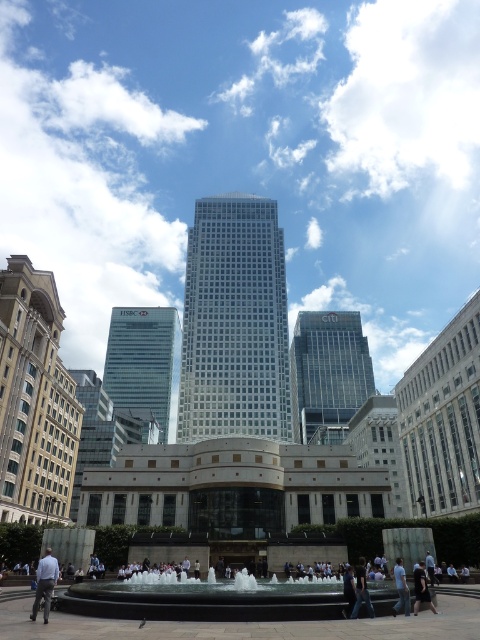
Question: Does white glass skyscraper at center have a smaller size compared to reflective glass fountain at center?

Choices:
 (A) no
 (B) yes

Answer: (A)

Question: Which of the following is the farthest from the observer?

Choices:
 (A) white glass skyscraper at center
 (B) white cotton shirt at lower right

Answer: (A)

Question: Which point is farther to the camera?

Choices:
 (A) (272, 595)
 (B) (421, 600)

Answer: (A)

Question: Which object is positioned farthest from the white glass skyscraper at center?

Choices:
 (A) reflective glass fountain at center
 (B) glassy reflective skyscraper at left
 (C) black fabric person at lower right
 (D) transparent glass skyscraper at center

Answer: (C)

Question: Observing the image, what is the correct spatial positioning of light blue shirt at lower left in reference to white cotton shirt at lower right?

Choices:
 (A) left
 (B) right

Answer: (A)

Question: In this image, where is transparent glass skyscraper at center located relative to white cotton shirt at lower right?

Choices:
 (A) below
 (B) above

Answer: (B)